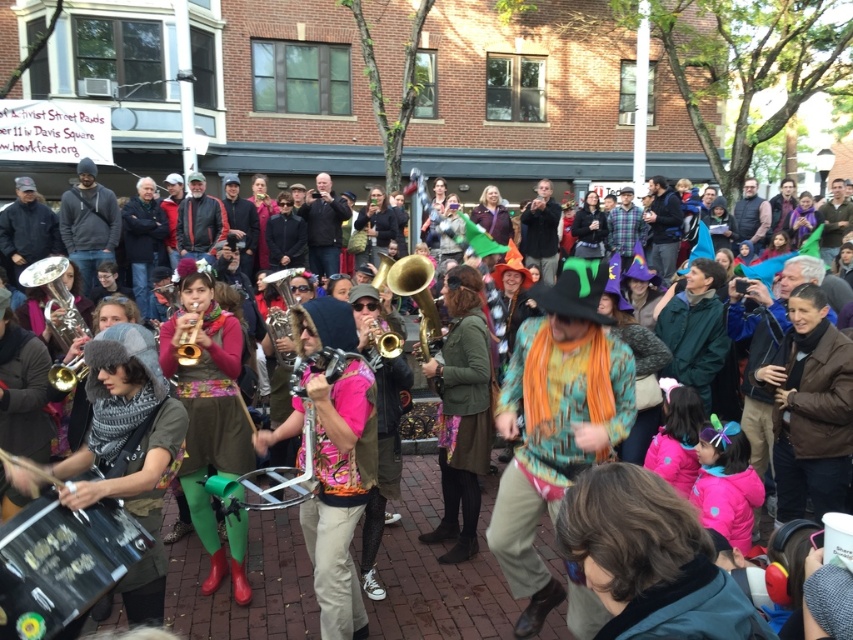
Question: Where is shiny silver trumpet at left located in relation to gold brass trumpet at center in the image?

Choices:
 (A) below
 (B) above

Answer: (B)

Question: Which object is the closest to the black drum at lower left?

Choices:
 (A) gold brass trumpet at center
 (B) shiny silver trumpet at left

Answer: (A)

Question: Which object appears closest to the camera in this image?

Choices:
 (A) shiny silver trumpet at left
 (B) shiny brass trombone at center

Answer: (A)

Question: Can you confirm if black drum at lower left is positioned to the left of brass saxophone at center?

Choices:
 (A) yes
 (B) no

Answer: (A)

Question: Which object appears closest to the camera in this image?

Choices:
 (A) floral-patterned scarf at center
 (B) gold brass trumpet at center

Answer: (A)

Question: Can you confirm if matte green leggings at center is thinner than black drum at lower left?

Choices:
 (A) yes
 (B) no

Answer: (B)